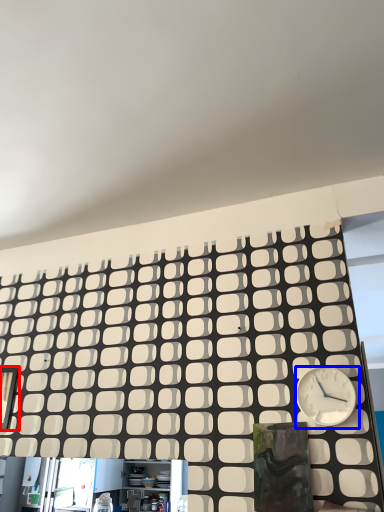
Question: Among these objects, which one is nearest to the camera, window (highlighted by a red box) or wall clock (highlighted by a blue box)?

Choices:
 (A) window
 (B) wall clock

Answer: (B)